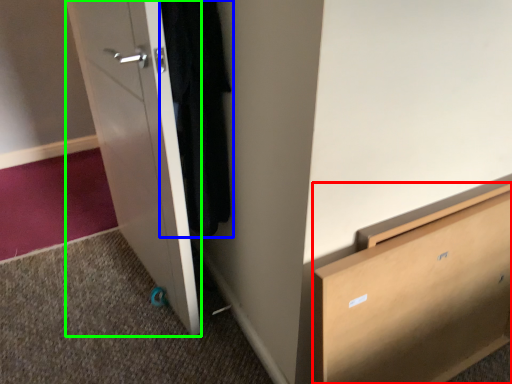
Question: Considering the real-world distances, which object is farthest from chest of drawers (highlighted by a red box)? clothing (highlighted by a blue box) or door (highlighted by a green box)?

Choices:
 (A) clothing
 (B) door

Answer: (B)